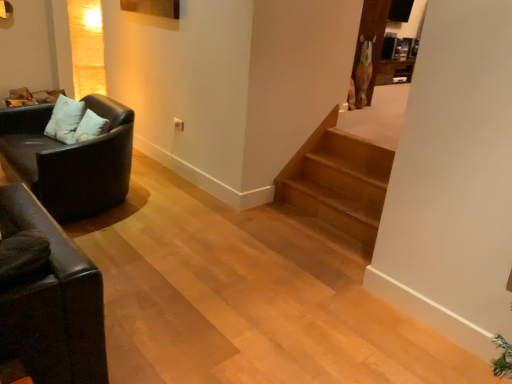
Question: In the image, is matte black couch at left positioned in front of or behind white soft pillow at left?

Choices:
 (A) behind
 (B) front

Answer: (B)

Question: Is matte black couch at left inside the boundaries of white soft pillow at left, or outside?

Choices:
 (A) outside
 (B) inside

Answer: (A)

Question: Based on their relative distances, which object is nearer to the light brown wooden stairs at center?

Choices:
 (A) white soft pillow at left
 (B) matte black couch at left

Answer: (B)

Question: Estimate the real-world distances between objects in this image. Which object is farther from the white soft pillow at left?

Choices:
 (A) matte black couch at left
 (B) light brown wooden stairs at center

Answer: (B)